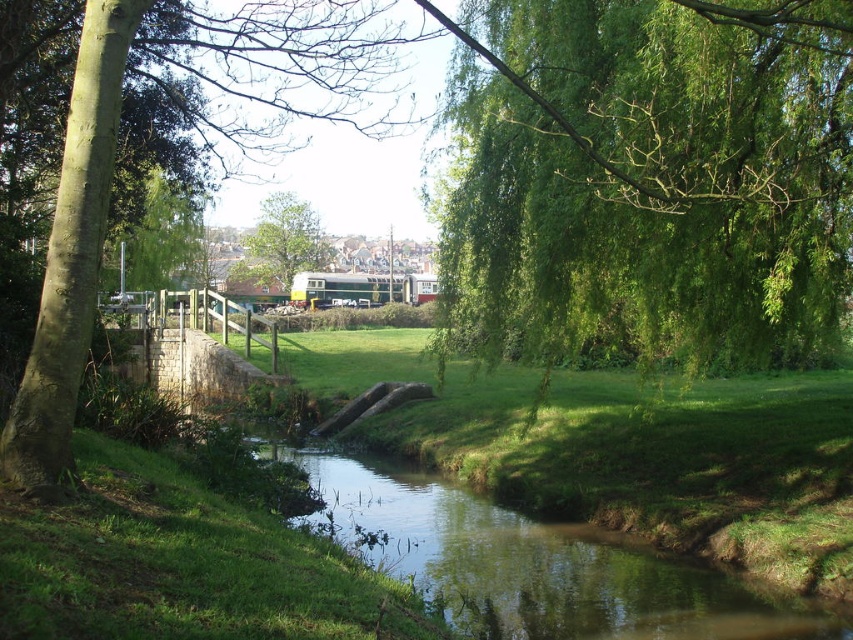
You are standing at the base of the green leafy tree at left and want to walk to the green leafy tree at upper right. Which direction should you head towards?

The green leafy tree at upper right is shorter than the green leafy tree at left. To reach it from the base of the green leafy tree at left, you should head towards the upper right direction, as the tree at upper right is positioned higher up in the image compared to the one at left.

You are standing at the point marked by the coordinates (158, 237) in the image. Looking around, you see a green leafy tree at upper left. Which direction should you face to look towards the tree trunk visible on the left side of the image?

The point marked by the coordinates (158, 237) is at the green leafy tree at upper left. To face the tree trunk visible on the left side of the image, you should turn to your right.